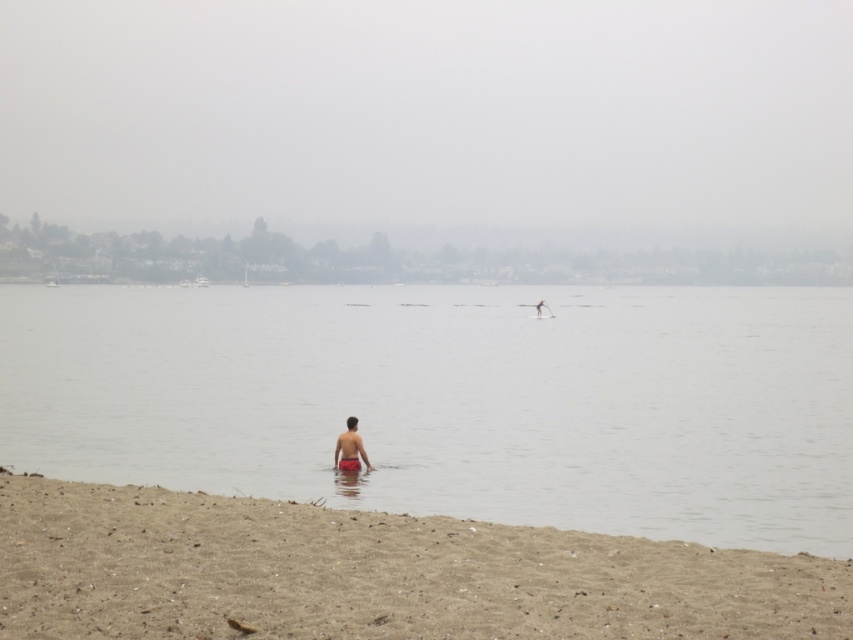
You are standing on the beach and want to find the clear water area to swim. According to the image, where exactly is the clear water at center located?

The clear water at center is located at point coordinates of (453,401).

You are a swimmer who wants to find the clearest part of the water to dive in. According to the image, where exactly is the clear water at center located?

The clear water at center is located at point coordinates of (453, 401).